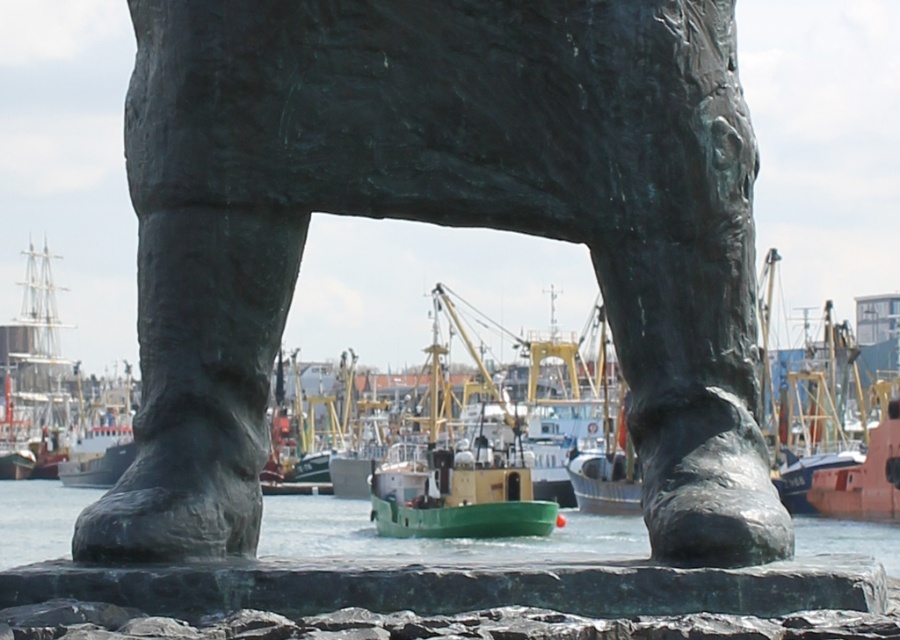
Question: Based on their relative distances, which object is nearer to the bronze statue at center?

Choices:
 (A) green matte boat at center
 (B) green matte water at center

Answer: (B)

Question: Where is green matte water at center located in relation to green matte boat at center in the image?

Choices:
 (A) below
 (B) above

Answer: (A)

Question: Which point is closer to the camera taking this photo?

Choices:
 (A) (439, 349)
 (B) (281, 132)
 (C) (551, 540)

Answer: (B)

Question: Does green matte water at center have a smaller size compared to green matte boat at center?

Choices:
 (A) no
 (B) yes

Answer: (A)

Question: Among these objects, which one is nearest to the camera?

Choices:
 (A) green matte boat at center
 (B) bronze statue at center

Answer: (B)

Question: Does bronze statue at center have a larger size compared to green matte boat at center?

Choices:
 (A) no
 (B) yes

Answer: (A)